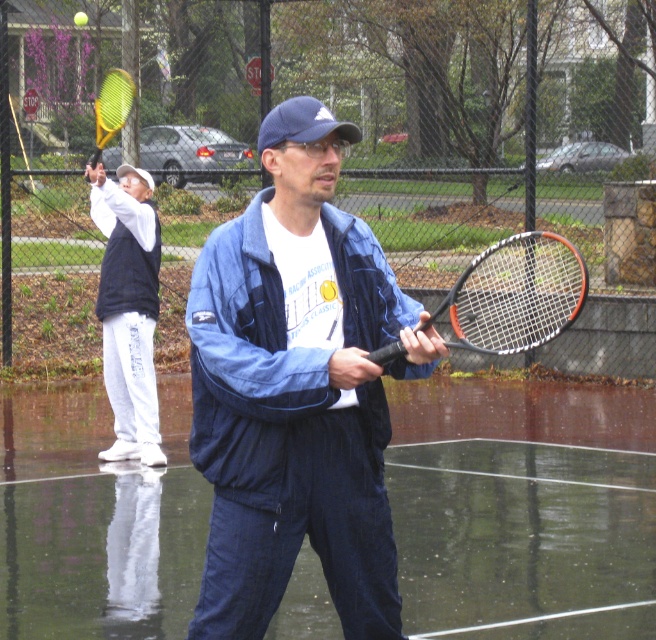
You are standing at the point with coordinates point (117, 120) and want to walk towards the point with coordinates point (276, 285). Which direction should you move in relative to the court?

You should move forward because point (276, 285) is in front of point (117, 120).

You are a photographer trying to capture a photo of the tennis players. The white fleece jacket at upper left and the blue fabric baseball cap at center are in the frame. Which object is positioned lower in the image?

The white fleece jacket at upper left is located below the blue fabric baseball cap at center, so the white fleece jacket at upper left is positioned lower in the image.